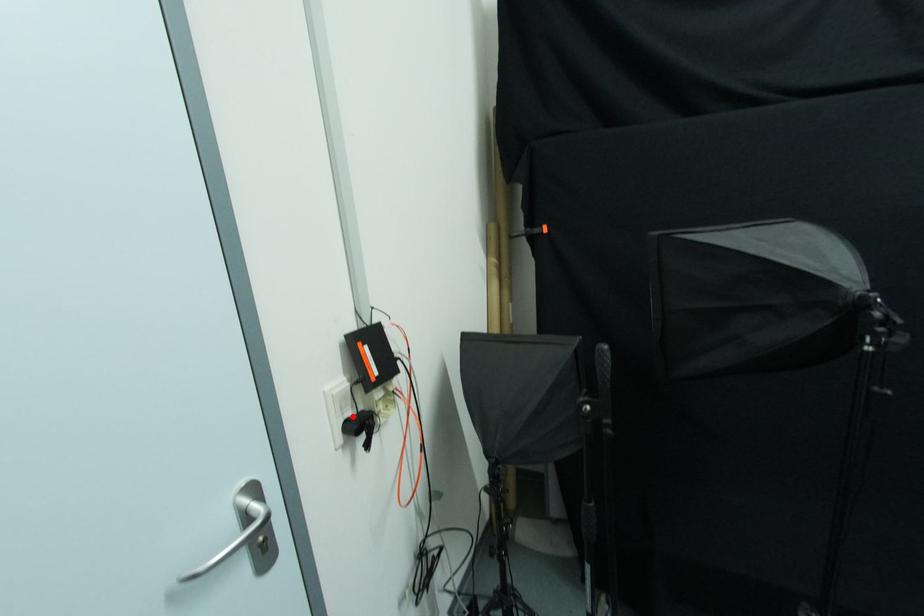
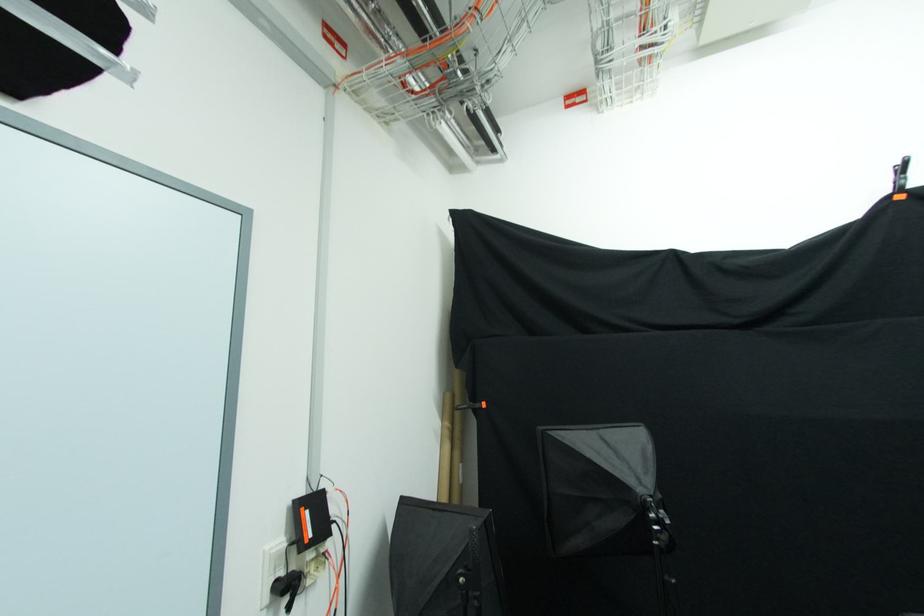
Find the pixel in the second image that matches the highlighted location in the first image.

(285, 577)